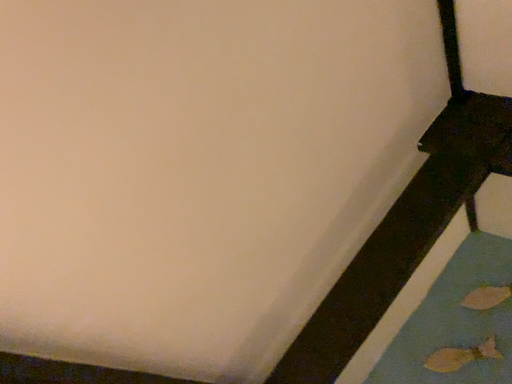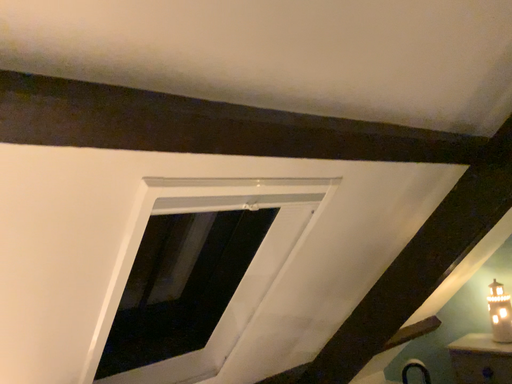
Question: Which way did the camera rotate in the video?

Choices:
 (A) rotated right
 (B) rotated left

Answer: (B)